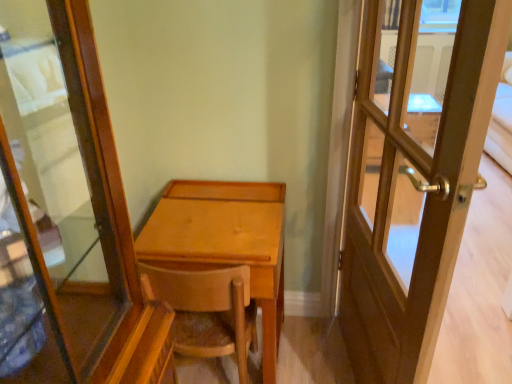
The height and width of the screenshot is (384, 512). Identify the location of wooden door at right. (413, 173).

What is the approximate height of light brown wood desk at center?

26.15 inches.

Locate an element on the screen. The height and width of the screenshot is (384, 512). wooden chair at center is located at coordinates (207, 311).

Is wooden door at right inside the boundaries of light brown wood desk at center, or outside?

wooden door at right is outside light brown wood desk at center.

Does wooden door at right come behind light brown wood desk at center?

No.

Is wooden door at right positioned far away from light brown wood desk at center?

That's not correct — wooden door at right is a little close to light brown wood desk at center.

Can you tell me how much wooden door at right and light brown wood desk at center differ in facing direction?

The angular difference between wooden door at right and light brown wood desk at center is 100 degrees.

Is wooden door at right looking in the opposite direction of wooden chair at center?

Yes, wooden door at right is facing away from wooden chair at center.

Is point (414, 175) closer or farther from the camera than point (221, 296)?

Clearly, point (414, 175) is closer to the camera than point (221, 296).

Between wooden door at right and wooden chair at center, which one has less height?

wooden chair at center.

In terms of size, does wooden chair at center appear bigger or smaller than wooden door at right?

In the image, wooden chair at center appears to be smaller than wooden door at right.

How many degrees apart are the facing directions of wooden chair at center and wooden door at right?

There is a 82.4-degree angle between the facing directions of wooden chair at center and wooden door at right.

Locate an element on the screen. This screenshot has width=512, height=384. chair below the wooden door at right (from the image's perspective) is located at coordinates (207, 311).

From the image's perspective, does light brown wood desk at center appear lower than wooden chair at center?

No.

Is light brown wood desk at center oriented towards wooden chair at center?

Yes, light brown wood desk at center is oriented towards wooden chair at center.

Does light brown wood desk at center have a smaller size compared to wooden chair at center?

Actually, light brown wood desk at center might be larger than wooden chair at center.

Which point is more forward, (x=262, y=241) or (x=437, y=58)?

The point (x=262, y=241) is in front.

Which object is wider, light brown wood desk at center or wooden door at right?

Wider between the two is light brown wood desk at center.

Is light brown wood desk at center located outside wooden door at right?

Yes, light brown wood desk at center is outside of wooden door at right.

Which is closer, (197,272) or (206,188)?

Point (197,272) appears to be closer to the viewer than point (206,188).

Does wooden chair at center touch light brown wood desk at center?

wooden chair at center and light brown wood desk at center are not in contact.

Consider the image. From a real-world perspective, is wooden chair at center physically located above or below light brown wood desk at center?

In terms of real-world spatial position, wooden chair at center is below light brown wood desk at center.

At what (x,y) coordinates should I click in order to perform the action: click on desk that is behind the wooden door at right. Please return your answer as a coordinate pair (x, y). Image resolution: width=512 pixels, height=384 pixels. Looking at the image, I should click on (224, 242).

At what (x,y) coordinates should I click in order to perform the action: click on chair below the wooden door at right (from the image's perspective). Please return your answer as a coordinate pair (x, y). The width and height of the screenshot is (512, 384). Looking at the image, I should click on (207, 311).

Based on their spatial positions, is light brown wood desk at center or wooden door at right closer to wooden chair at center?

The object closer to wooden chair at center is light brown wood desk at center.

Considering their positions, is wooden door at right positioned further to light brown wood desk at center than wooden chair at center?

wooden door at right.

Looking at the image, which one is located further to wooden door at right, wooden chair at center or light brown wood desk at center?

The object further to wooden door at right is wooden chair at center.

From the image, which object appears to be farther from light brown wood desk at center, wooden chair at center or wooden door at right?

wooden door at right is further to light brown wood desk at center.

Based on their spatial positions, is wooden door at right or light brown wood desk at center closer to wooden chair at center?

Among the two, light brown wood desk at center is located nearer to wooden chair at center.

Estimate the real-world distances between objects in this image. Which object is closer to wooden door at right, light brown wood desk at center or wooden chair at center?

The object closer to wooden door at right is light brown wood desk at center.

This screenshot has width=512, height=384. I want to click on desk between wooden chair at center and wooden door at right in the horizontal direction, so click(224, 242).